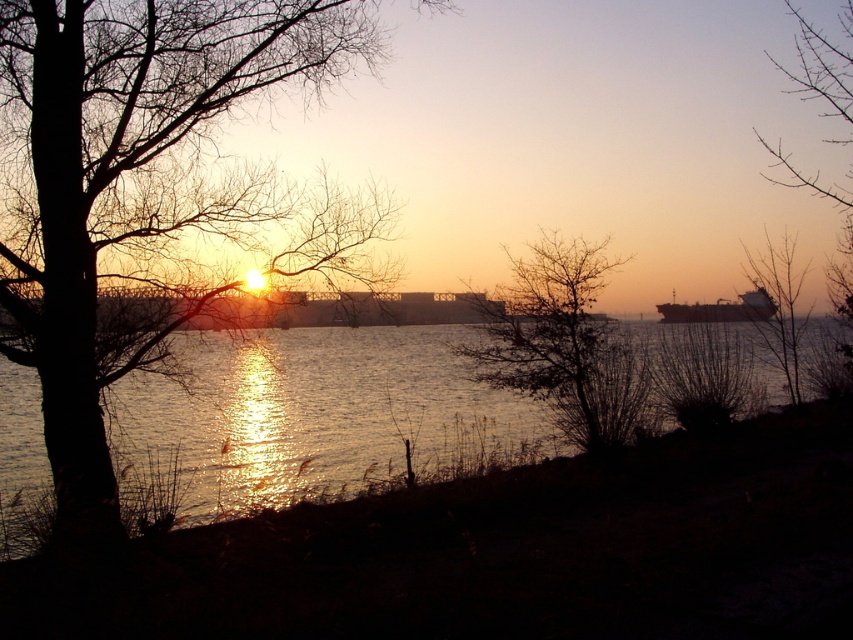
Question: Which object is farther from the camera taking this photo?

Choices:
 (A) dark brown bark tree at left
 (B) metallic ship at right
 (C) bare branches at center
 (D) bare branches at right

Answer: (D)

Question: Is glistening water at center above bare branches at center?

Choices:
 (A) no
 (B) yes

Answer: (A)

Question: Based on their relative distances, which object is nearer to the dark brown bark tree at left?

Choices:
 (A) bare branches at center
 (B) glistening water at center
 (C) bare branches at right

Answer: (B)

Question: Does glistening water at center have a lesser width compared to bare branches at center?

Choices:
 (A) yes
 (B) no

Answer: (B)

Question: Which of the following is the closest to the observer?

Choices:
 (A) (764, 307)
 (B) (485, 406)

Answer: (B)

Question: Is bare branches at right to the left of metallic ship at right from the viewer's perspective?

Choices:
 (A) yes
 (B) no

Answer: (B)